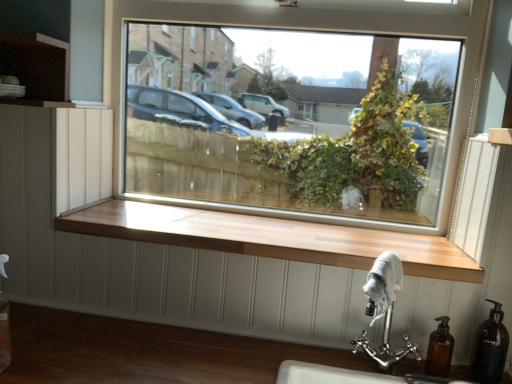
Question: Is polished chrome sink at lower right closer to the viewer compared to wooden at center?

Choices:
 (A) yes
 (B) no

Answer: (A)

Question: Considering the relative positions of polished chrome sink at lower right and wooden at center in the image provided, is polished chrome sink at lower right to the left of wooden at center from the viewer's perspective?

Choices:
 (A) no
 (B) yes

Answer: (A)

Question: Can you confirm if polished chrome sink at lower right is wider than wooden at center?

Choices:
 (A) yes
 (B) no

Answer: (B)

Question: Can you confirm if polished chrome sink at lower right is positioned to the right of wooden at center?

Choices:
 (A) yes
 (B) no

Answer: (A)

Question: From a real-world perspective, is polished chrome sink at lower right on top of wooden at center?

Choices:
 (A) yes
 (B) no

Answer: (B)

Question: From a real-world perspective, is translucent brown soap dispenser at lower right, the second soap dispenser from the left, physically located above or below brown matte soap dispenser at lower right, the 1th soap dispenser positioned from the left?

Choices:
 (A) below
 (B) above

Answer: (B)

Question: Is point (497, 360) positioned closer to the camera than point (429, 374)?

Choices:
 (A) closer
 (B) farther

Answer: (B)

Question: Considering the positions of translucent brown soap dispenser at lower right, the second soap dispenser from the left, and brown matte soap dispenser at lower right, the 2th soap dispenser when ordered from right to left, in the image, is translucent brown soap dispenser at lower right, the second soap dispenser from the left, taller or shorter than brown matte soap dispenser at lower right, the 2th soap dispenser when ordered from right to left,?

Choices:
 (A) short
 (B) tall

Answer: (B)

Question: Is translucent brown soap dispenser at lower right, which is the first soap dispenser in right-to-left order, bigger or smaller than brown matte soap dispenser at lower right, the 1th soap dispenser positioned from the left?

Choices:
 (A) big
 (B) small

Answer: (A)

Question: From a real-world perspective, is transparent glass window at center positioned above or below translucent brown soap dispenser at lower right, which is the first soap dispenser in right-to-left order?

Choices:
 (A) below
 (B) above

Answer: (B)

Question: In the image, is transparent glass window at center positioned in front of or behind translucent brown soap dispenser at lower right, which is the first soap dispenser in right-to-left order?

Choices:
 (A) front
 (B) behind

Answer: (B)

Question: Which is correct: transparent glass window at center is inside translucent brown soap dispenser at lower right, the second soap dispenser from the left, or outside of it?

Choices:
 (A) outside
 (B) inside

Answer: (A)

Question: Would you say transparent glass window at center is to the left or to the right of translucent brown soap dispenser at lower right, the second soap dispenser from the left, in the picture?

Choices:
 (A) left
 (B) right

Answer: (A)

Question: Do you think translucent brown soap dispenser at lower right, the second soap dispenser from the left, is within transparent glass window at center, or outside of it?

Choices:
 (A) inside
 (B) outside

Answer: (B)

Question: Looking at the image, does translucent brown soap dispenser at lower right, the second soap dispenser from the left, seem bigger or smaller compared to transparent glass window at center?

Choices:
 (A) big
 (B) small

Answer: (B)